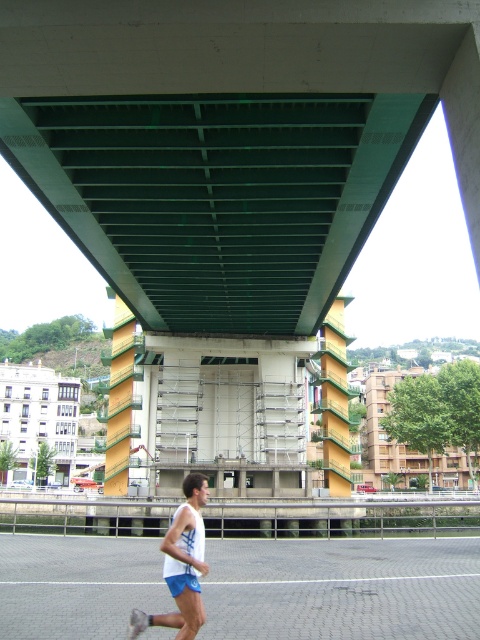
Question: Considering the relative positions of green painted steel bridge at upper center and white matte tank top at lower center in the image provided, where is green painted steel bridge at upper center located with respect to white matte tank top at lower center?

Choices:
 (A) left
 (B) right

Answer: (B)

Question: Among these points, which one is farthest from the camera?

Choices:
 (A) (7, 26)
 (B) (152, 616)

Answer: (A)

Question: Is green painted steel bridge at upper center wider than white matte tank top at lower center?

Choices:
 (A) yes
 (B) no

Answer: (A)

Question: In this image, where is green painted steel bridge at upper center located relative to white matte tank top at lower center?

Choices:
 (A) right
 (B) left

Answer: (A)